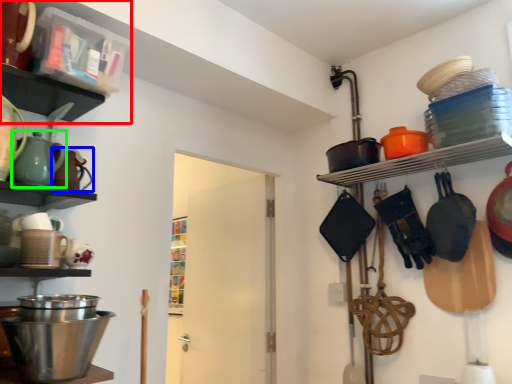
Question: Which is farther away from shelf (highlighted by a red box)? tea pot (highlighted by a blue box) or tea pot (highlighted by a green box)?

Choices:
 (A) tea pot
 (B) tea pot

Answer: (A)